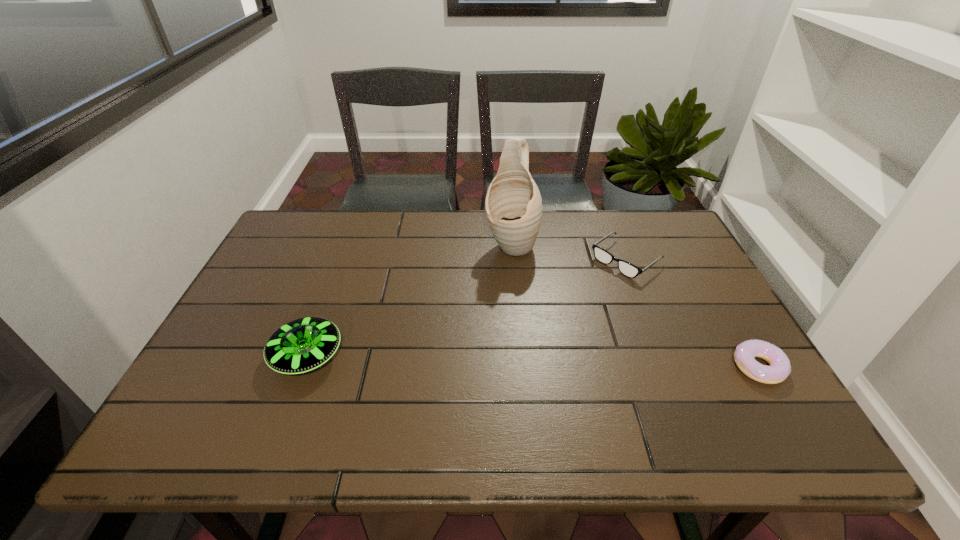
I want to click on free space between the second tallest object and the rightmost object, so click(533, 361).

Where is `vacant space that is in between the leftmost object and the rightmost object`? vacant space that is in between the leftmost object and the rightmost object is located at coordinates (533, 361).

Where is `vacant area that lies between the pitcher and the doughnut`? vacant area that lies between the pitcher and the doughnut is located at coordinates [635, 306].

Find the location of a particular element. The height and width of the screenshot is (540, 960). vacant point located between the saucer and the tallest object is located at coordinates (409, 301).

The image size is (960, 540). I want to click on vacant area that lies between the third object from left to right and the leftmost object, so click(467, 308).

Find the location of a particular element. free point between the third object from left to right and the pitcher is located at coordinates (568, 253).

The height and width of the screenshot is (540, 960). I want to click on free space between the rightmost object and the saucer, so click(533, 361).

Identify the location of vacant point located between the second tallest object and the tallest object. The width and height of the screenshot is (960, 540). (409, 301).

I want to click on free space between the pitcher and the doughnut, so click(635, 306).

The image size is (960, 540). I want to click on unoccupied area between the spectacles and the tallest object, so click(568, 253).